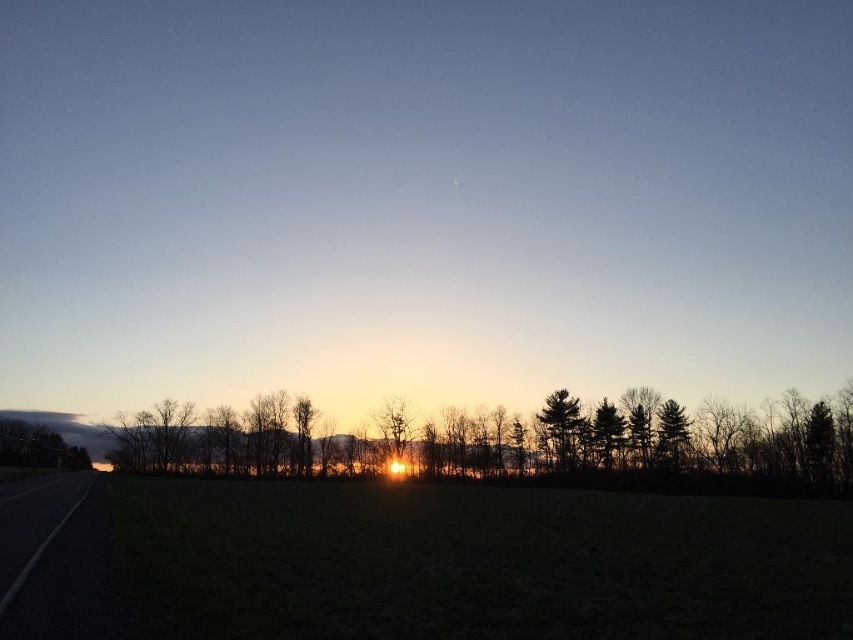
Question: Among these points, which one is farthest from the camera?

Choices:
 (A) (567, 403)
 (B) (233, 452)
 (C) (55, 477)

Answer: (B)

Question: Which point is farther from the camera taking this photo?

Choices:
 (A) (759, 449)
 (B) (48, 580)
 (C) (561, 458)

Answer: (C)

Question: Is black asphalt highway at lower left further to camera compared to dark green textured tree at center right?

Choices:
 (A) no
 (B) yes

Answer: (A)

Question: Is black asphalt highway at lower left wider than dark green textured tree at center right?

Choices:
 (A) yes
 (B) no

Answer: (A)

Question: From the image, what is the correct spatial relationship of black asphalt highway at lower left in relation to dark green textured tree at center right?

Choices:
 (A) left
 (B) right

Answer: (A)

Question: Which of the following is the closest to the observer?

Choices:
 (A) dark green textured tree at center right
 (B) silhouette trees at center
 (C) black asphalt highway at lower left

Answer: (C)